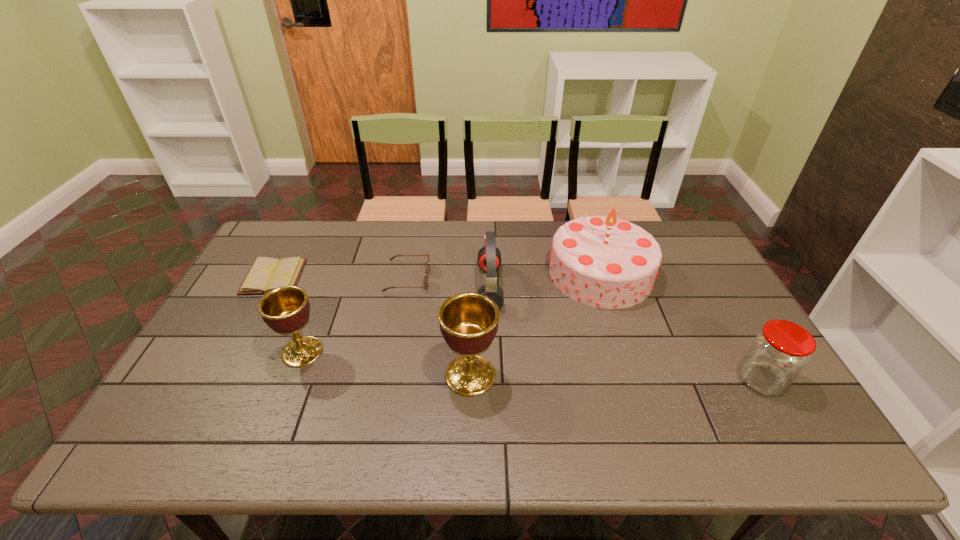
Image resolution: width=960 pixels, height=540 pixels. In order to click on free space located 0.310m on the right of the second object from left to right in this screenshot , I will do `click(440, 352)`.

Where is `vacant space situated 0.360m on the left of the taller chalice`? The height and width of the screenshot is (540, 960). vacant space situated 0.360m on the left of the taller chalice is located at coordinates (301, 375).

I want to click on free space located 0.300m on the right of the leftmost object, so click(x=396, y=276).

This screenshot has width=960, height=540. Identify the location of free location located 0.050m on the left of the sixth object from left to right. (533, 273).

You are a GUI agent. You are given a task and a screenshot of the screen. Output one action in this format:
    pyautogui.click(x=<x>, y=<y>)
    Task: Click on the blank space located on the lenses of the sunglasses
    
    Given the screenshot: What is the action you would take?
    pyautogui.click(x=556, y=279)

Find the location of a particular element. The image size is (960, 540). vacant space situated on the ear cups of the earphone is located at coordinates (381, 287).

I want to click on free space located on the ear cups of the earphone, so click(372, 287).

You are a GUI agent. You are given a task and a screenshot of the screen. Output one action in this format:
    pyautogui.click(x=<x>, y=<y>)
    Task: Click on the vacant region located 0.070m on the ear cups of the earphone
    The width and height of the screenshot is (960, 540).
    Given the screenshot: What is the action you would take?
    pyautogui.click(x=455, y=287)

You are a GUI agent. You are given a task and a screenshot of the screen. Output one action in this format:
    pyautogui.click(x=<x>, y=<y>)
    Task: Click on the vacant space located on the back of the rightmost object
    Image resolution: width=960 pixels, height=540 pixels.
    Given the screenshot: What is the action you would take?
    pyautogui.click(x=740, y=344)

The image size is (960, 540). Identify the location of diary that is positioned at the far edge. (265, 274).